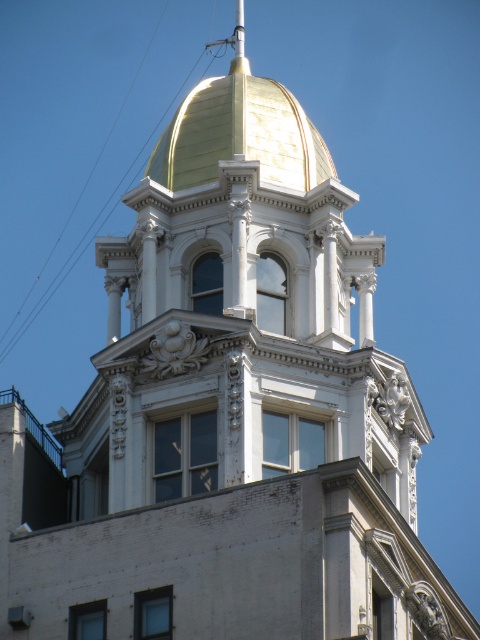
Question: Considering the relative positions of gold polished dome at upper center and transparent wire at upper left in the image provided, where is gold polished dome at upper center located with respect to transparent wire at upper left?

Choices:
 (A) left
 (B) right

Answer: (B)

Question: Does gold polished dome at upper center have a larger size compared to transparent wire at upper left?

Choices:
 (A) no
 (B) yes

Answer: (B)

Question: Which point is farther to the camera?

Choices:
 (A) (204, 108)
 (B) (57, 285)

Answer: (B)

Question: Observing the image, what is the correct spatial positioning of gold polished dome at upper center in reference to transparent wire at upper left?

Choices:
 (A) below
 (B) above

Answer: (A)